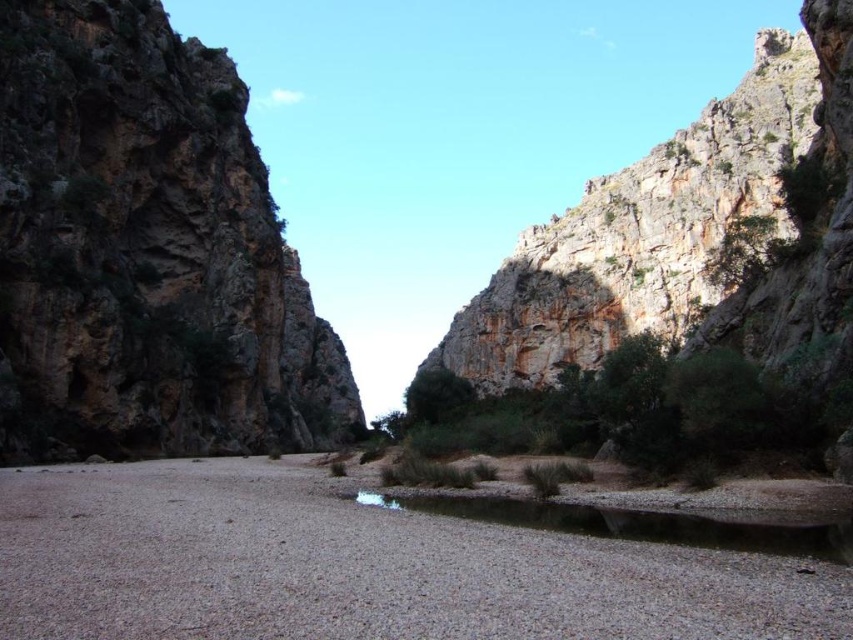
You are a hiker trying to cross the canyon. You have two options to navigate the terrain. One path leads through the rustic rock mountain at left, and the other follows the clear gravel river at center. Considering the size of the objects, which path might be more challenging and why?

The path through the rustic rock mountain at left is likely more challenging because it is larger in size than the clear gravel river at center, making it potentially steeper and more rugged.